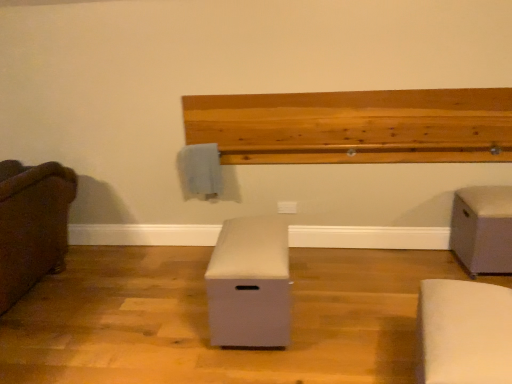
Measure the distance between white fabric ottoman at lower right, which appears as the third furniture when viewed from the left, and camera.

4.10 feet.

Describe the element at coordinates (355, 126) in the screenshot. I see `natural wood ledge at upper center` at that location.

Image resolution: width=512 pixels, height=384 pixels. What do you see at coordinates (482, 229) in the screenshot?
I see `beige fabric ottoman at right, which is counted as the 4th furniture, starting from the left` at bounding box center [482, 229].

At what (x,y) coordinates should I click in order to perform the action: click on beige fabric ottoman at center, the 3th furniture positioned from the right. Please return your answer as a coordinate pair (x, y). The image size is (512, 384). Looking at the image, I should click on (249, 284).

Is beige fabric ottoman at right, acting as the first furniture starting from the right, beside brown fabric couch at left, arranged as the fourth furniture when viewed from the right?

No, beige fabric ottoman at right, acting as the first furniture starting from the right, is not next to brown fabric couch at left, arranged as the fourth furniture when viewed from the right.

From a real-world perspective, is beige fabric ottoman at right, which is counted as the 4th furniture, starting from the left, positioned under brown fabric couch at left, marked as the 1th furniture in a left-to-right arrangement, based on gravity?

Yes, from a real-world perspective, beige fabric ottoman at right, which is counted as the 4th furniture, starting from the left, is beneath brown fabric couch at left, marked as the 1th furniture in a left-to-right arrangement.

Considering the positions of objects beige fabric ottoman at right, which is counted as the 4th furniture, starting from the left, and brown fabric couch at left, marked as the 1th furniture in a left-to-right arrangement, in the image provided, who is more to the left, beige fabric ottoman at right, which is counted as the 4th furniture, starting from the left, or brown fabric couch at left, marked as the 1th furniture in a left-to-right arrangement,?

brown fabric couch at left, marked as the 1th furniture in a left-to-right arrangement, is more to the left.

Which is correct: beige fabric ottoman at right, which is counted as the 4th furniture, starting from the left, is inside brown fabric couch at left, marked as the 1th furniture in a left-to-right arrangement, or outside of it?

The correct answer is: outside.

The image size is (512, 384). Identify the location of the 2nd furniture counting from the left of the white fabric ottoman at lower right, which appears as the third furniture when viewed from the left. (32, 224).

In the scene shown: Considering the relative sizes of brown fabric couch at left, marked as the 1th furniture in a left-to-right arrangement, and white fabric ottoman at lower right, acting as the 2th furniture starting from the right, in the image provided, is brown fabric couch at left, marked as the 1th furniture in a left-to-right arrangement, bigger than white fabric ottoman at lower right, acting as the 2th furniture starting from the right,?

Yes.

Is there a large distance between brown fabric couch at left, arranged as the fourth furniture when viewed from the right, and white fabric ottoman at lower right, which appears as the third furniture when viewed from the left?

Yes, brown fabric couch at left, arranged as the fourth furniture when viewed from the right, and white fabric ottoman at lower right, which appears as the third furniture when viewed from the left, are located far from each other.

Is beige fabric ottoman at center, marked as the 2th furniture in a left-to-right arrangement, at the right side of brown fabric couch at left, arranged as the fourth furniture when viewed from the right?

Yes, beige fabric ottoman at center, marked as the 2th furniture in a left-to-right arrangement, is to the right of brown fabric couch at left, arranged as the fourth furniture when viewed from the right.

Is beige fabric ottoman at center, the 3th furniture positioned from the right, inside or outside of brown fabric couch at left, marked as the 1th furniture in a left-to-right arrangement?

beige fabric ottoman at center, the 3th furniture positioned from the right, cannot be found inside brown fabric couch at left, marked as the 1th furniture in a left-to-right arrangement.

From the image's perspective, would you say beige fabric ottoman at center, marked as the 2th furniture in a left-to-right arrangement, is positioned over brown fabric couch at left, arranged as the fourth furniture when viewed from the right?

Actually, beige fabric ottoman at center, marked as the 2th furniture in a left-to-right arrangement, appears below brown fabric couch at left, arranged as the fourth furniture when viewed from the right, in the image.

Is beige fabric ottoman at center, the 3th furniture positioned from the right, in front of brown fabric couch at left, arranged as the fourth furniture when viewed from the right?

No, beige fabric ottoman at center, the 3th furniture positioned from the right, is behind brown fabric couch at left, arranged as the fourth furniture when viewed from the right.

Considering the relative positions of natural wood ledge at upper center and brown fabric couch at left, arranged as the fourth furniture when viewed from the right, in the image provided, is natural wood ledge at upper center to the left or to the right of brown fabric couch at left, arranged as the fourth furniture when viewed from the right,?

Clearly, natural wood ledge at upper center is on the right of brown fabric couch at left, arranged as the fourth furniture when viewed from the right, in the image.

Is natural wood ledge at upper center wider than brown fabric couch at left, arranged as the fourth furniture when viewed from the right?

Incorrect, the width of natural wood ledge at upper center does not surpass that of brown fabric couch at left, arranged as the fourth furniture when viewed from the right.

Is natural wood ledge at upper center turned away from brown fabric couch at left, arranged as the fourth furniture when viewed from the right?

That's not correct — natural wood ledge at upper center is not looking away from brown fabric couch at left, arranged as the fourth furniture when viewed from the right.

Looking at this image, is natural wood ledge at upper center not close to brown fabric couch at left, marked as the 1th furniture in a left-to-right arrangement?

natural wood ledge at upper center is positioned a significant distance from brown fabric couch at left, marked as the 1th furniture in a left-to-right arrangement.

Is brown fabric couch at left, marked as the 1th furniture in a left-to-right arrangement, oriented towards beige fabric ottoman at center, the 3th furniture positioned from the right?

No, brown fabric couch at left, marked as the 1th furniture in a left-to-right arrangement, is not turned towards beige fabric ottoman at center, the 3th furniture positioned from the right.

Are brown fabric couch at left, arranged as the fourth furniture when viewed from the right, and beige fabric ottoman at center, the 3th furniture positioned from the right, far apart?

Yes, brown fabric couch at left, arranged as the fourth furniture when viewed from the right, is far from beige fabric ottoman at center, the 3th furniture positioned from the right.

Image resolution: width=512 pixels, height=384 pixels. Identify the location of furniture that is the 1st one when counting rightward from the brown fabric couch at left, arranged as the fourth furniture when viewed from the right. (249, 284).

Looking at this image, how far apart are brown fabric couch at left, marked as the 1th furniture in a left-to-right arrangement, and beige fabric ottoman at center, the 3th furniture positioned from the right?

brown fabric couch at left, marked as the 1th furniture in a left-to-right arrangement, is 1.31 meters away from beige fabric ottoman at center, the 3th furniture positioned from the right.

Would you say beige fabric ottoman at center, the 3th furniture positioned from the right, contains natural wood ledge at upper center?

No, natural wood ledge at upper center is not surrounded by beige fabric ottoman at center, the 3th furniture positioned from the right.

Which object is positioned more to the right, beige fabric ottoman at center, the 3th furniture positioned from the right, or natural wood ledge at upper center?

natural wood ledge at upper center.

From a real-world perspective, is beige fabric ottoman at center, marked as the 2th furniture in a left-to-right arrangement, under natural wood ledge at upper center?

Yes, from a real-world perspective, beige fabric ottoman at center, marked as the 2th furniture in a left-to-right arrangement, is under natural wood ledge at upper center.

In the scene shown: Between beige fabric ottoman at center, the 3th furniture positioned from the right, and natural wood ledge at upper center, which one has larger size?

natural wood ledge at upper center.

Which object is positioned more to the left, white fabric ottoman at lower right, acting as the 2th furniture starting from the right, or beige fabric ottoman at center, the 3th furniture positioned from the right?

beige fabric ottoman at center, the 3th furniture positioned from the right.

Between white fabric ottoman at lower right, acting as the 2th furniture starting from the right, and beige fabric ottoman at center, the 3th furniture positioned from the right, which one has smaller width?

white fabric ottoman at lower right, acting as the 2th furniture starting from the right.

From the picture: From a real-world perspective, is white fabric ottoman at lower right, acting as the 2th furniture starting from the right, positioned over beige fabric ottoman at center, the 3th furniture positioned from the right, based on gravity?

Incorrect, from a real-world perspective, white fabric ottoman at lower right, acting as the 2th furniture starting from the right, is lower than beige fabric ottoman at center, the 3th furniture positioned from the right.

Is white fabric ottoman at lower right, which appears as the third furniture when viewed from the left, situated inside beige fabric ottoman at center, marked as the 2th furniture in a left-to-right arrangement, or outside?

white fabric ottoman at lower right, which appears as the third furniture when viewed from the left, is located beyond the bounds of beige fabric ottoman at center, marked as the 2th furniture in a left-to-right arrangement.

At what (x,y) coordinates should I click in order to perform the action: click on the 2nd furniture in front of the beige fabric ottoman at right, which is counted as the 4th furniture, starting from the left, counting from the anchor's position. Please return your answer as a coordinate pair (x, y). Looking at the image, I should click on (32, 224).

The width and height of the screenshot is (512, 384). There is a brown fabric couch at left, marked as the 1th furniture in a left-to-right arrangement. What are the coordinates of `the 3rd furniture below it (from a real-world perspective)` in the screenshot? It's located at (464, 332).

When comparing their distances from white fabric ottoman at lower right, which appears as the third furniture when viewed from the left, does natural wood ledge at upper center or brown fabric couch at left, arranged as the fourth furniture when viewed from the right, seem further?

brown fabric couch at left, arranged as the fourth furniture when viewed from the right, is further to white fabric ottoman at lower right, which appears as the third furniture when viewed from the left.

When comparing their distances from beige fabric ottoman at center, the 3th furniture positioned from the right, does white fabric ottoman at lower right, which appears as the third furniture when viewed from the left, or natural wood ledge at upper center seem further?

natural wood ledge at upper center.

From the image, which object appears to be nearer to beige fabric ottoman at center, the 3th furniture positioned from the right, brown fabric couch at left, marked as the 1th furniture in a left-to-right arrangement, or white fabric ottoman at lower right, acting as the 2th furniture starting from the right?

white fabric ottoman at lower right, acting as the 2th furniture starting from the right.

In the scene shown: Based on their spatial positions, is brown fabric couch at left, arranged as the fourth furniture when viewed from the right, or white fabric ottoman at lower right, acting as the 2th furniture starting from the right, closer to beige fabric ottoman at right, which is counted as the 4th furniture, starting from the left?

white fabric ottoman at lower right, acting as the 2th furniture starting from the right, is closer to beige fabric ottoman at right, which is counted as the 4th furniture, starting from the left.

Estimate the real-world distances between objects in this image. Which object is closer to brown fabric couch at left, marked as the 1th furniture in a left-to-right arrangement, beige fabric ottoman at right, acting as the first furniture starting from the right, or white fabric ottoman at lower right, acting as the 2th furniture starting from the right?

Based on the image, white fabric ottoman at lower right, acting as the 2th furniture starting from the right, appears to be nearer to brown fabric couch at left, marked as the 1th furniture in a left-to-right arrangement.

Looking at the image, which one is located further to white fabric ottoman at lower right, which appears as the third furniture when viewed from the left, beige fabric ottoman at center, marked as the 2th furniture in a left-to-right arrangement, or natural wood ledge at upper center?

natural wood ledge at upper center.

From the image, which object appears to be nearer to white fabric ottoman at lower right, acting as the 2th furniture starting from the right, beige fabric ottoman at right, which is counted as the 4th furniture, starting from the left, or brown fabric couch at left, arranged as the fourth furniture when viewed from the right?

beige fabric ottoman at right, which is counted as the 4th furniture, starting from the left, lies closer to white fabric ottoman at lower right, acting as the 2th furniture starting from the right, than the other object.

Looking at the image, which one is located closer to beige fabric ottoman at right, which is counted as the 4th furniture, starting from the left, brown fabric couch at left, arranged as the fourth furniture when viewed from the right, or beige fabric ottoman at center, the 3th furniture positioned from the right?

The object closer to beige fabric ottoman at right, which is counted as the 4th furniture, starting from the left, is beige fabric ottoman at center, the 3th furniture positioned from the right.

Locate an element on the screen. furniture between brown fabric couch at left, arranged as the fourth furniture when viewed from the right, and white fabric ottoman at lower right, acting as the 2th furniture starting from the right, in the horizontal direction is located at coordinates (249, 284).

You are a GUI agent. You are given a task and a screenshot of the screen. Output one action in this format:
    pyautogui.click(x=<x>, y=<y>)
    Task: Click on the furniture located between brown fabric couch at left, arranged as the fourth furniture when viewed from the right, and natural wood ledge at upper center in the left-right direction
    Image resolution: width=512 pixels, height=384 pixels.
    Given the screenshot: What is the action you would take?
    pyautogui.click(x=249, y=284)

At what (x,y) coordinates should I click in order to perform the action: click on ledge situated between brown fabric couch at left, marked as the 1th furniture in a left-to-right arrangement, and white fabric ottoman at lower right, acting as the 2th furniture starting from the right, from left to right. Please return your answer as a coordinate pair (x, y). This screenshot has width=512, height=384. Looking at the image, I should click on (355, 126).

Find the location of a particular element. furniture between beige fabric ottoman at center, marked as the 2th furniture in a left-to-right arrangement, and beige fabric ottoman at right, which is counted as the 4th furniture, starting from the left, from left to right is located at coordinates (464, 332).